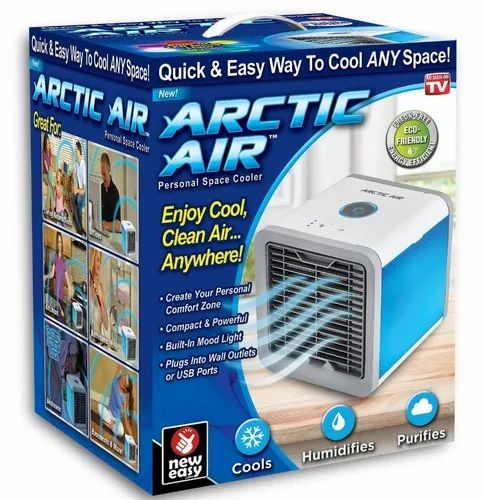
In order to click on box in this screenshot , I will do `click(290, 189)`.